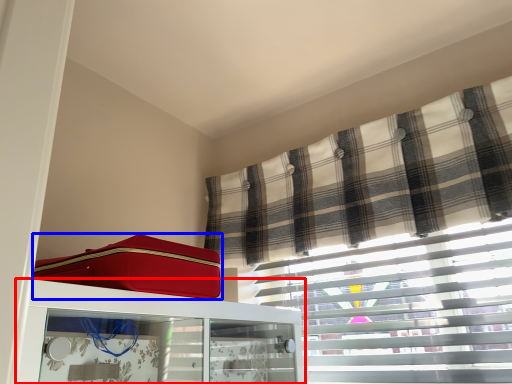
Question: Which object is further to the camera taking this photo, furniture (highlighted by a red box) or suitcase (highlighted by a blue box)?

Choices:
 (A) furniture
 (B) suitcase

Answer: (B)